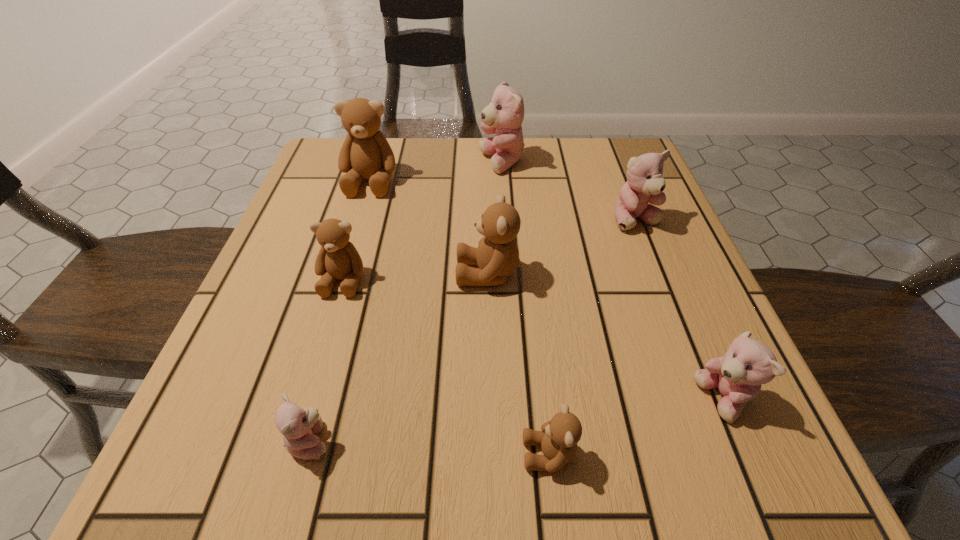
You are a GUI agent. You are given a task and a screenshot of the screen. Output one action in this format:
    pyautogui.click(x=<x>, y=<y>)
    Task: Click on the unoccupied area between the leftmost pink teddy bear and the smallest brown teddy bear
    
    Given the screenshot: What is the action you would take?
    pyautogui.click(x=430, y=447)

Identify the location of vacant area between the nearest brown teddy bear and the second farthest pink teddy bear. The height and width of the screenshot is (540, 960). (592, 338).

Locate an element on the screen. The width and height of the screenshot is (960, 540). vacant area that lies between the biggest brown teddy bear and the second biggest brown teddy bear is located at coordinates tap(429, 227).

I want to click on empty space between the third biggest pink teddy bear and the smallest pink teddy bear, so click(516, 420).

Image resolution: width=960 pixels, height=540 pixels. I want to click on object that is the seventh closest to the third smallest brown teddy bear, so click(748, 363).

The image size is (960, 540). I want to click on object that is the fourth nearest to the nearest brown teddy bear, so click(x=338, y=258).

Locate an element on the screen. This screenshot has height=540, width=960. teddy bear that stands as the closest to the biggest pink teddy bear is located at coordinates [365, 153].

Identify the location of teddy bear that can be found as the closest to the third farthest teddy bear. This screenshot has width=960, height=540. (504, 115).

Where is `the second closest pink teddy bear to the third biggest pink teddy bear`? This screenshot has width=960, height=540. the second closest pink teddy bear to the third biggest pink teddy bear is located at coordinates (299, 426).

Locate which pink teddy bear is the closest to the nearest brown teddy bear. Please provide its 2D coordinates. Your answer should be formatted as a tuple, i.e. [(x, y)], where the tuple contains the x and y coordinates of a point satisfying the conditions above.

[(748, 363)]